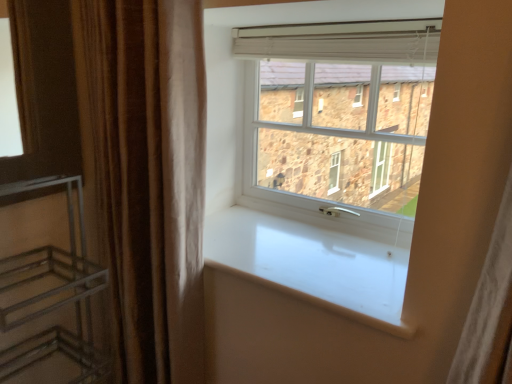
Question: Should I look upward or downward to see brown velvet curtain at left?

Choices:
 (A) up
 (B) down

Answer: (B)

Question: Can you confirm if brown velvet curtain at left is thinner than white plastic window at center?

Choices:
 (A) yes
 (B) no

Answer: (B)

Question: From a real-world perspective, is brown velvet curtain at left on white plastic window at center?

Choices:
 (A) yes
 (B) no

Answer: (B)

Question: Is brown velvet curtain at left beside white plastic window at center?

Choices:
 (A) no
 (B) yes

Answer: (A)

Question: Does brown velvet curtain at left have a greater height compared to white plastic window at center?

Choices:
 (A) yes
 (B) no

Answer: (A)

Question: Is brown velvet curtain at left shorter than white plastic window at center?

Choices:
 (A) no
 (B) yes

Answer: (A)

Question: Would you say brown velvet curtain at left is outside white plastic window at center?

Choices:
 (A) no
 (B) yes

Answer: (B)

Question: From a real-world perspective, is white plastic window at center located beneath metallic silver shelf at left?

Choices:
 (A) no
 (B) yes

Answer: (A)

Question: Is white plastic window at center far away from metallic silver shelf at left?

Choices:
 (A) yes
 (B) no

Answer: (B)

Question: Does white plastic window at center have a lesser width compared to metallic silver shelf at left?

Choices:
 (A) yes
 (B) no

Answer: (A)

Question: Is the surface of white plastic window at center in direct contact with metallic silver shelf at left?

Choices:
 (A) no
 (B) yes

Answer: (A)

Question: Is white plastic window at center taller than metallic silver shelf at left?

Choices:
 (A) yes
 (B) no

Answer: (B)

Question: Does white plastic window at center come in front of metallic silver shelf at left?

Choices:
 (A) yes
 (B) no

Answer: (B)

Question: Is brown velvet curtain at left not inside white glossy window sill at center?

Choices:
 (A) no
 (B) yes

Answer: (B)